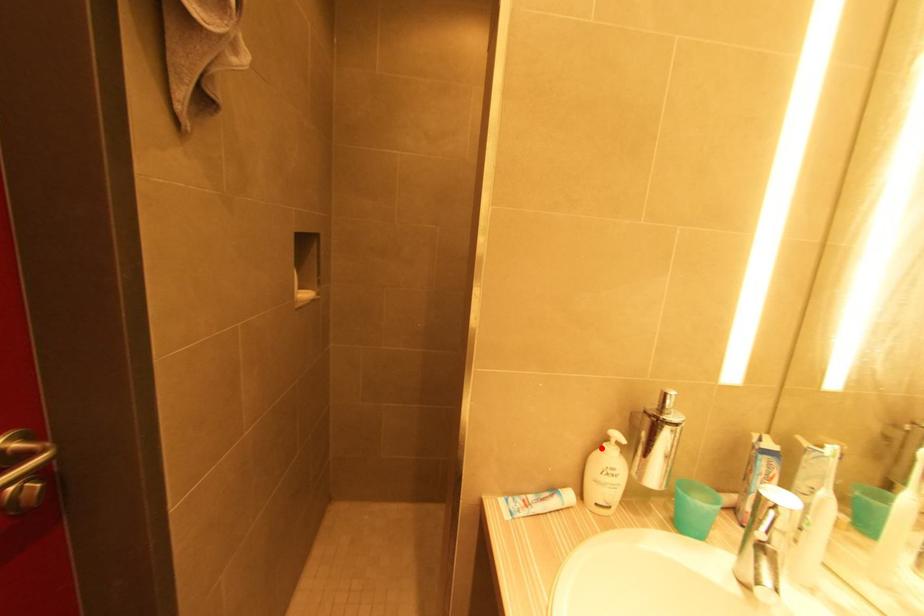
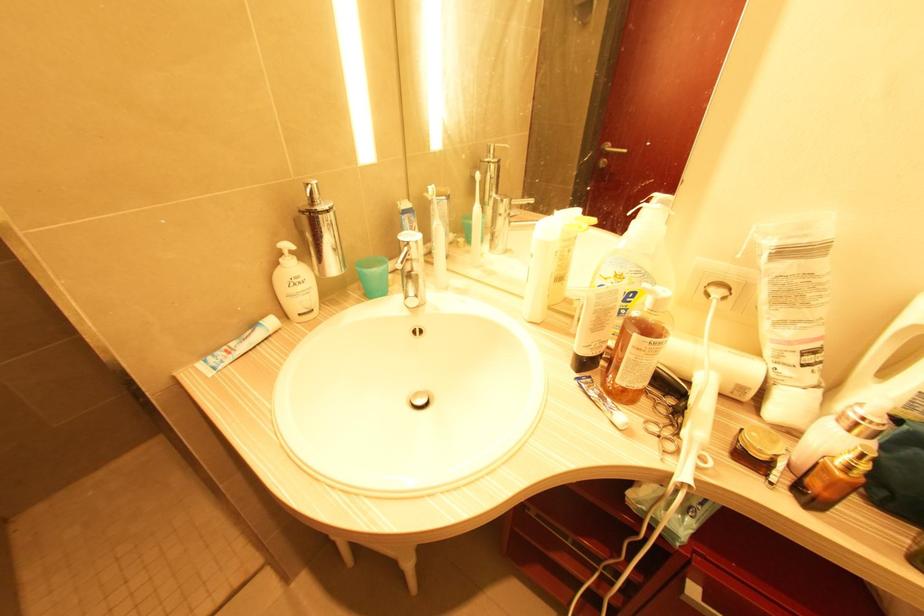
Where in the second image is the point corresponding to the highlighted location from the first image?

(280, 265)